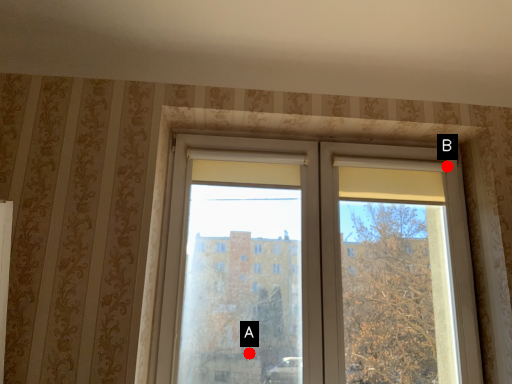
Question: Two points are circled on the image, labeled by A and B beside each circle. Which point is further to the camera?

Choices:
 (A) A is further
 (B) B is further

Answer: (B)